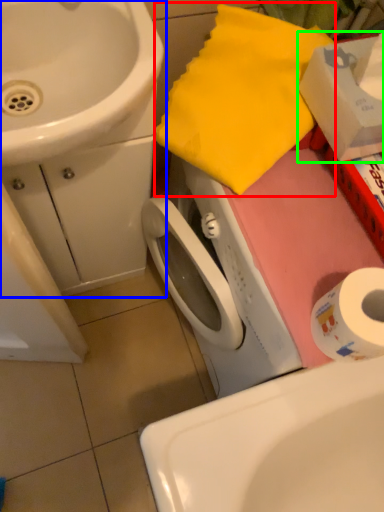
Question: Based on their relative distances, which object is farther from beach towel (highlighted by a red box)? Choose from sink (highlighted by a blue box) and box (highlighted by a green box).

Choices:
 (A) sink
 (B) box

Answer: (A)